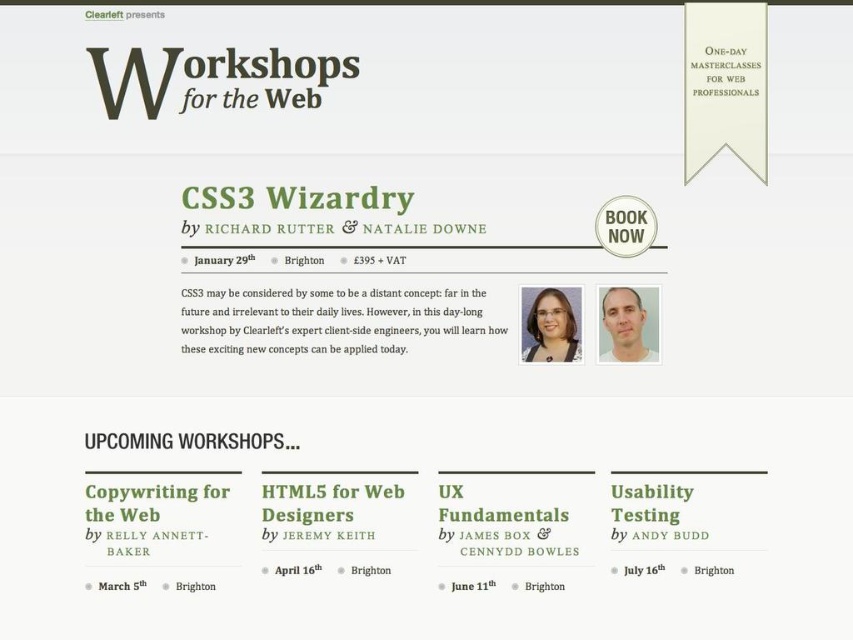
Question: Does black text at center appear under greentextured paperdate at center?

Choices:
 (A) yes
 (B) no

Answer: (B)

Question: Can you confirm if black text at center is positioned to the left of green paper at center?

Choices:
 (A) yes
 (B) no

Answer: (A)

Question: Is black paper text at center below black text at center?

Choices:
 (A) yes
 (B) no

Answer: (B)

Question: Among these points, which one is nearest to the camera?

Choices:
 (A) (450, 589)
 (B) (705, 56)
 (C) (479, 330)
 (D) (267, 435)

Answer: (B)

Question: Among these points, which one is farthest from the camera?

Choices:
 (A) (202, 296)
 (B) (318, 570)
 (C) (747, 81)
 (D) (88, 442)

Answer: (A)

Question: Which is farther from the white paper at upper right?

Choices:
 (A) green paper at center
 (B) greentextured paperdate at center
 (C) black text at center

Answer: (A)